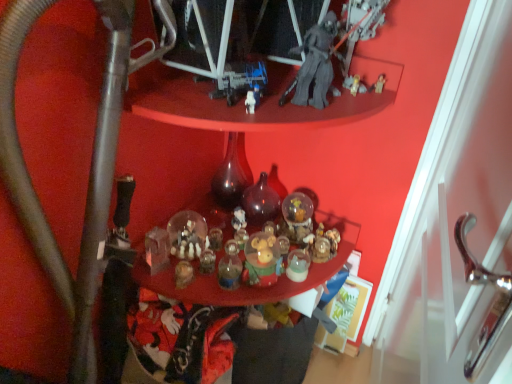
You are a GUI agent. You are given a task and a screenshot of the screen. Output one action in this format:
    pyautogui.click(x=<x>, y=<y>)
    Task: Click on the free point above translucent glass ornaments at center (from a real-world perspective)
    The width and height of the screenshot is (512, 384).
    Given the screenshot: What is the action you would take?
    pyautogui.click(x=229, y=250)